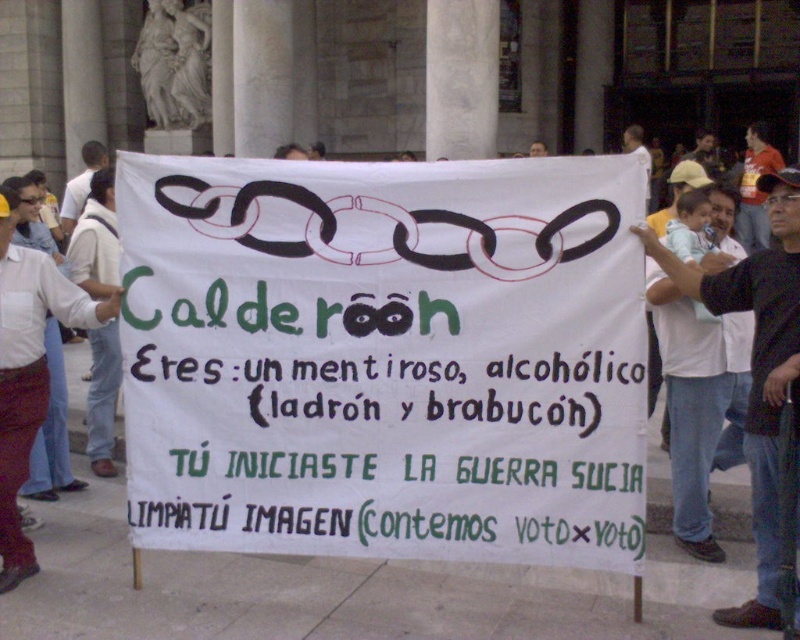
What is the spatial relationship between the white paper banner at center and the white shirt at upper left in the protest scene?

A: The white paper banner at center is located to the right of the white shirt at upper left.

You are taking a photo of the protest banner and notice two points marked on the banner. The first point is at coordinates point (4,420) and the second is at point (104,150). Which point will appear larger in the photo?

Point (4,420) is closer to the camera than point (104,150), so it will appear larger in the photo.

Consider the image. You are a photographer trying to capture the protest scene. You notice two white shirts in the image. Which one would appear bigger in your photo if you focus on the white shirt at center and the white shirt at upper left?

The white shirt at center would appear bigger in the photo because it has a larger size compared to the white shirt at upper left.